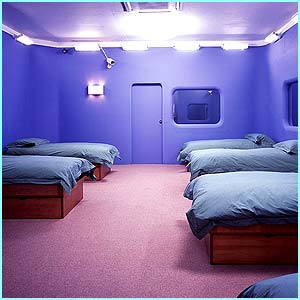
Locate an element on the screen. The height and width of the screenshot is (300, 300). light is located at coordinates (99, 82).